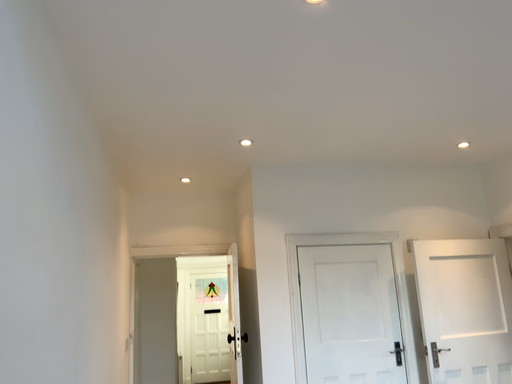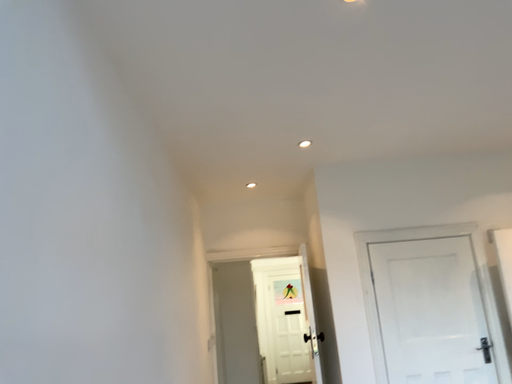
Question: How did the camera likely rotate when shooting the video?

Choices:
 (A) rotated left
 (B) rotated right

Answer: (A)